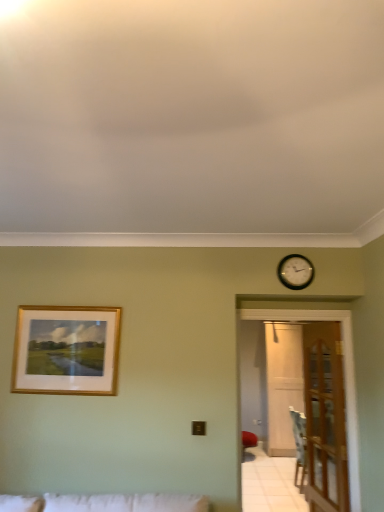
Question: Can you confirm if clear glass door at right, the second glass door in the right-to-left sequence, is shorter than black wooden clock at upper right?

Choices:
 (A) yes
 (B) no

Answer: (B)

Question: From the image's perspective, is clear glass door at right, which is counted as the 1th glass door, starting from the left, located above black wooden clock at upper right?

Choices:
 (A) no
 (B) yes

Answer: (A)

Question: Is black wooden clock at upper right a part of clear glass door at right, arranged as the 2th glass door when viewed from the back?

Choices:
 (A) no
 (B) yes

Answer: (A)

Question: Is clear glass door at right, arranged as the 2th glass door when viewed from the back, further to the viewer compared to black wooden clock at upper right?

Choices:
 (A) yes
 (B) no

Answer: (A)

Question: Is clear glass door at right, the second glass door in the right-to-left sequence, to the left of black wooden clock at upper right from the viewer's perspective?

Choices:
 (A) yes
 (B) no

Answer: (B)

Question: In the image, is clear glass door at right, arranged as the 2th glass door when viewed from the back, on the left side or the right side of gold-framed picture at upper left?

Choices:
 (A) left
 (B) right

Answer: (B)

Question: Is point (345, 329) closer or farther from the camera than point (94, 315)?

Choices:
 (A) farther
 (B) closer

Answer: (A)

Question: Looking at their shapes, would you say clear glass door at right, which is counted as the 1th glass door, starting from the left, is wider or thinner than gold-framed picture at upper left?

Choices:
 (A) wide
 (B) thin

Answer: (A)

Question: Based on their sizes in the image, would you say clear glass door at right, the 1th glass door when ordered from front to back, is bigger or smaller than gold-framed picture at upper left?

Choices:
 (A) small
 (B) big

Answer: (B)

Question: Is wooden at right to the left or to the right of gold-framed picture at upper left in the image?

Choices:
 (A) right
 (B) left

Answer: (A)

Question: Considering the positions of wooden at right and gold-framed picture at upper left in the image, is wooden at right taller or shorter than gold-framed picture at upper left?

Choices:
 (A) tall
 (B) short

Answer: (A)

Question: Is wooden at right wider or thinner than gold-framed picture at upper left?

Choices:
 (A) thin
 (B) wide

Answer: (B)

Question: Is point (337, 333) closer or farther from the camera than point (61, 375)?

Choices:
 (A) farther
 (B) closer

Answer: (A)

Question: Is point (281, 365) positioned closer to the camera than point (350, 370)?

Choices:
 (A) farther
 (B) closer

Answer: (A)

Question: Is transparent wooden door at right, the 2th glass door in the left-to-right sequence, inside or outside of clear glass door at right, the 1th glass door when ordered from front to back?

Choices:
 (A) inside
 (B) outside

Answer: (B)